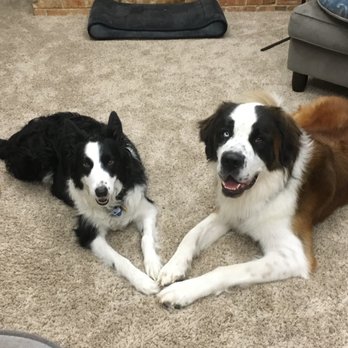
The image size is (348, 348). Identify the location of dog bed. (177, 26).